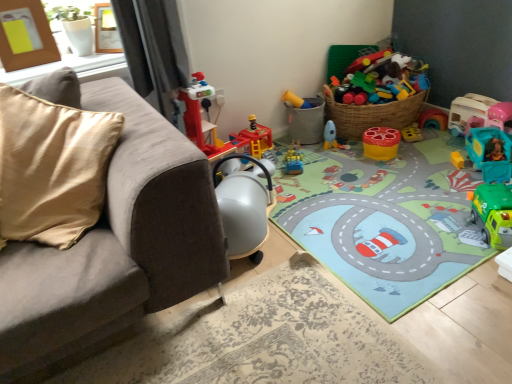
Where is `free space in front of yellow matte stool at center, arranged as the 3th toy when viewed from the left`? The width and height of the screenshot is (512, 384). free space in front of yellow matte stool at center, arranged as the 3th toy when viewed from the left is located at coordinates (393, 167).